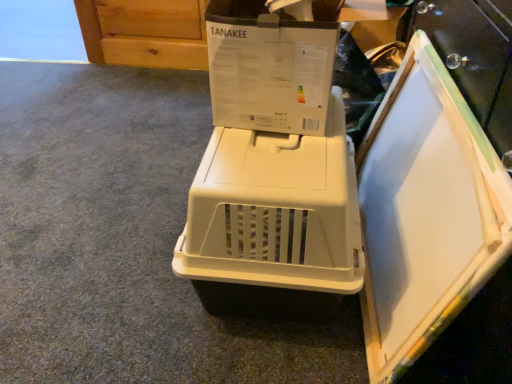
Locate an element on the screen. The width and height of the screenshot is (512, 384). vacant space to the left of white plastic board at right is located at coordinates coord(155,273).